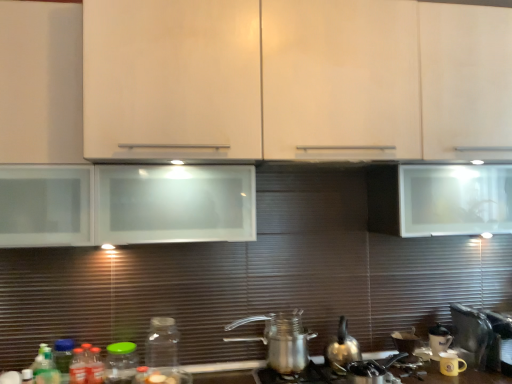
Question: Is metallic silver coffee pot at center at the right side of silver metallic gas stove at lower center?

Choices:
 (A) yes
 (B) no

Answer: (B)

Question: Can you confirm if metallic silver coffee pot at center is wider than silver metallic gas stove at lower center?

Choices:
 (A) yes
 (B) no

Answer: (B)

Question: From the image's perspective, is metallic silver coffee pot at center beneath silver metallic gas stove at lower center?

Choices:
 (A) no
 (B) yes

Answer: (A)

Question: Is metallic silver coffee pot at center far from silver metallic gas stove at lower center?

Choices:
 (A) yes
 (B) no

Answer: (B)

Question: Are metallic silver coffee pot at center and silver metallic gas stove at lower center beside each other?

Choices:
 (A) no
 (B) yes

Answer: (A)

Question: Does metallic silver coffee pot at center come in front of silver metallic gas stove at lower center?

Choices:
 (A) yes
 (B) no

Answer: (B)

Question: Is matte white cabinet at center thinner than metallic silver toaster at lower right, which is the 3th appliance from left to right?

Choices:
 (A) yes
 (B) no

Answer: (B)

Question: Is matte white cabinet at center at the left side of metallic silver toaster at lower right, marked as the 1th appliance in a right-to-left arrangement?

Choices:
 (A) no
 (B) yes

Answer: (B)

Question: Is matte white cabinet at center in front of metallic silver toaster at lower right, marked as the 1th appliance in a right-to-left arrangement?

Choices:
 (A) no
 (B) yes

Answer: (B)

Question: Is matte white cabinet at center outside of metallic silver toaster at lower right, marked as the 1th appliance in a right-to-left arrangement?

Choices:
 (A) yes
 (B) no

Answer: (A)

Question: From the image's perspective, would you say matte white cabinet at center is shown under metallic silver toaster at lower right, which is the 3th appliance from left to right?

Choices:
 (A) yes
 (B) no

Answer: (B)

Question: Is matte white cabinet at center taller than metallic silver toaster at lower right, marked as the 1th appliance in a right-to-left arrangement?

Choices:
 (A) yes
 (B) no

Answer: (A)

Question: Is green matte bottle at lower left, which appears as the 4th bottle when viewed from the right, wider than metallic silver coffee pot at center?

Choices:
 (A) yes
 (B) no

Answer: (B)